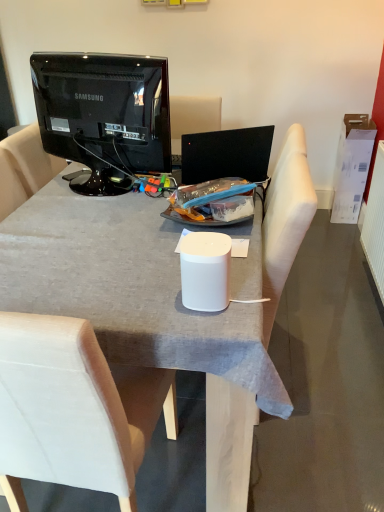
Find the location of a particular element. Image resolution: width=384 pixels, height=512 pixels. white fabric chair at center is located at coordinates (74, 409).

Locate an element on the screen. white cardboard box at right is located at coordinates (352, 167).

Describe the element at coordinates (105, 117) in the screenshot. I see `glossy black television at upper left` at that location.

Identify the location of glossy black television at upper left. The width and height of the screenshot is (384, 512). (105, 117).

Image resolution: width=384 pixels, height=512 pixels. Find the location of `white matte desk at center`. white matte desk at center is located at coordinates tap(127, 288).

What do you see at coordinates (205, 271) in the screenshot? This screenshot has width=384, height=512. I see `white matte smart speaker at center` at bounding box center [205, 271].

Find the location of `white fabric armchair at center`. white fabric armchair at center is located at coordinates (284, 219).

Identify the location of white fabric chair at center. (74, 409).

Which is behind, white matte smart speaker at center or white fabric chair at center?

white matte smart speaker at center is further away from the camera.

Is white matte smart speaker at center oriented towards white fabric chair at center?

No.

Would you say white matte smart speaker at center contains white fabric chair at center?

No, white matte smart speaker at center does not contain white fabric chair at center.

Based on the photo, from a real-world perspective, is white fabric chair at center below white matte smart speaker at center?

Indeed, from a real-world perspective, white fabric chair at center is positioned beneath white matte smart speaker at center.

Does point (155, 372) come closer to viewer compared to point (198, 307)?

No.

Is white fabric chair at center to the left or to the right of white matte smart speaker at center in the image?

In the image, white fabric chair at center appears on the left side of white matte smart speaker at center.

Would you say white fabric chair at center is outside white matte smart speaker at center?

Indeed, white fabric chair at center is completely outside white matte smart speaker at center.

How different are the orientations of white fabric armchair at center and white matte smart speaker at center in degrees?

90 degrees separate the facing orientations of white fabric armchair at center and white matte smart speaker at center.

In terms of size, does white fabric armchair at center appear bigger or smaller than white matte smart speaker at center?

white fabric armchair at center is bigger than white matte smart speaker at center.

Is white fabric armchair at center oriented away from white matte smart speaker at center?

white fabric armchair at center is not turned away from white matte smart speaker at center.

Between glossy black television at upper left and white cardboard box at right, which one has smaller size?

white cardboard box at right.

From a real-world perspective, is glossy black television at upper left beneath white cardboard box at right?

No, from a real-world perspective, glossy black television at upper left is not beneath white cardboard box at right.

Does glossy black television at upper left have a lesser width compared to white cardboard box at right?

Indeed, glossy black television at upper left has a lesser width compared to white cardboard box at right.

Which is correct: glossy black television at upper left is inside white cardboard box at right, or outside of it?

glossy black television at upper left is spatially situated outside white cardboard box at right.

Which of these two, white cardboard box at right or glossy black television at upper left, is bigger?

With larger size is glossy black television at upper left.

From the image's perspective, is white cardboard box at right above or below glossy black television at upper left?

white cardboard box at right is above glossy black television at upper left.

The width and height of the screenshot is (384, 512). Identify the location of box behind the glossy black television at upper left. (352, 167).

Who is more distant, white cardboard box at right or glossy black television at upper left?

white cardboard box at right is further away from the camera.

From the image's perspective, which is below, white fabric chair at center or white fabric armchair at center?

white fabric chair at center is shown below in the image.

Considering the sizes of objects white fabric chair at center and white fabric armchair at center in the image provided, who is taller, white fabric chair at center or white fabric armchair at center?

Standing taller between the two is white fabric armchair at center.

Visually, is white fabric chair at center positioned to the left or to the right of white fabric armchair at center?

Clearly, white fabric chair at center is on the left of white fabric armchair at center in the image.

Who is more distant, white fabric chair at center or white fabric armchair at center?

white fabric armchair at center is more distant.

Looking at this image, is white fabric chair at center looking in the opposite direction of white matte desk at center?

Absolutely, white fabric chair at center is directed away from white matte desk at center.

Considering the sizes of white fabric chair at center and white matte desk at center in the image, is white fabric chair at center wider or thinner than white matte desk at center?

white fabric chair at center is thinner than white matte desk at center.

In the scene shown: Is white fabric chair at center in front of or behind white matte desk at center in the image?

Clearly, white fabric chair at center is in front of white matte desk at center.

Considering the points (45, 454) and (250, 322), which point is behind, point (45, 454) or point (250, 322)?

The point (250, 322) is behind.

In order to click on chair lying on the left of white matte smart speaker at center in this screenshot , I will do `click(74, 409)`.

Locate an element on the screen. The height and width of the screenshot is (512, 384). trash bin/can located above the white fabric chair at center (from the image's perspective) is located at coordinates (205, 271).

From the picture: Estimate the real-world distances between objects in this image. Which object is further from glossy black television at upper left, white matte smart speaker at center or white fabric armchair at center?

Based on the image, white matte smart speaker at center appears to be further to glossy black television at upper left.

Based on their spatial positions, is white matte desk at center or white matte smart speaker at center further from white fabric chair at center?

Based on the image, white matte smart speaker at center appears to be further to white fabric chair at center.

Estimate the real-world distances between objects in this image. Which object is further from white fabric armchair at center, white matte desk at center or white cardboard box at right?

white cardboard box at right is positioned further to the anchor white fabric armchair at center.

Looking at the image, which one is located further to glossy black television at upper left, white fabric chair at center or white matte smart speaker at center?

white fabric chair at center is positioned further to the anchor glossy black television at upper left.

From the image, which object appears to be nearer to white fabric chair at center, white fabric armchair at center or white cardboard box at right?

Based on the image, white fabric armchair at center appears to be nearer to white fabric chair at center.

Considering their positions, is white matte desk at center positioned further to white cardboard box at right than white matte smart speaker at center?

white matte smart speaker at center.

Which object lies further to the anchor point white matte desk at center, white matte smart speaker at center or glossy black television at upper left?

Based on the image, glossy black television at upper left appears to be further to white matte desk at center.

Considering their positions, is white fabric chair at center positioned closer to white matte desk at center than white fabric armchair at center?

white fabric armchair at center is positioned closer to the anchor white matte desk at center.

The image size is (384, 512). I want to click on desk between white fabric chair at center and white fabric armchair at center in the front-back direction, so click(127, 288).

Locate an element on the screen. The height and width of the screenshot is (512, 384). armchair between glossy black television at upper left and white matte smart speaker at center vertically is located at coordinates (284, 219).

Where is `armchair between glossy black television at upper left and white fabric chair at center vertically`? This screenshot has height=512, width=384. armchair between glossy black television at upper left and white fabric chair at center vertically is located at coordinates (284, 219).

Identify the location of desk between glossy black television at upper left and white fabric chair at center in the vertical direction. The height and width of the screenshot is (512, 384). (127, 288).